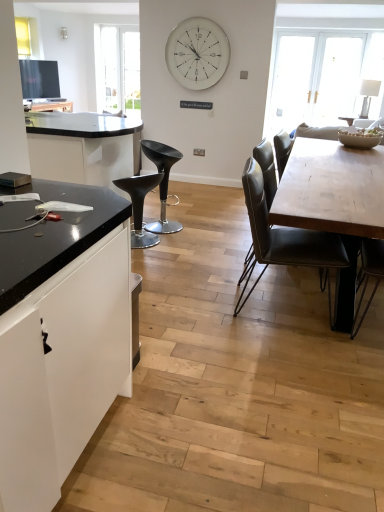
Question: Choose the correct answer: Is leather-like black chair at center, the 3th chair when ordered from back to front, inside white glossy clock at upper center or outside it?

Choices:
 (A) outside
 (B) inside

Answer: (A)

Question: From a real-world perspective, relative to white glossy clock at upper center, is leather-like black chair at center, marked as the first chair in a right-to-left arrangement, vertically above or below?

Choices:
 (A) below
 (B) above

Answer: (A)

Question: Which object is positioned closest to the wooden table at center?

Choices:
 (A) white glossy clock at upper center
 (B) black matte cabinet at left
 (C) matte black stool at center, placed as the third chair when sorted from right to left
 (D) black plastic stool at center, the second chair from the right
 (E) leather-like black chair at center, marked as the third chair in a left-to-right arrangement

Answer: (E)

Question: Considering the real-world distances, which object is closest to the wooden table at center?

Choices:
 (A) black plastic stool at center, the second chair viewed from the left
 (B) leather-like black chair at center, marked as the third chair in a left-to-right arrangement
 (C) white glossy clock at upper center
 (D) matte black stool at center, placed as the third chair when sorted from right to left
 (E) black matte cabinet at left

Answer: (B)